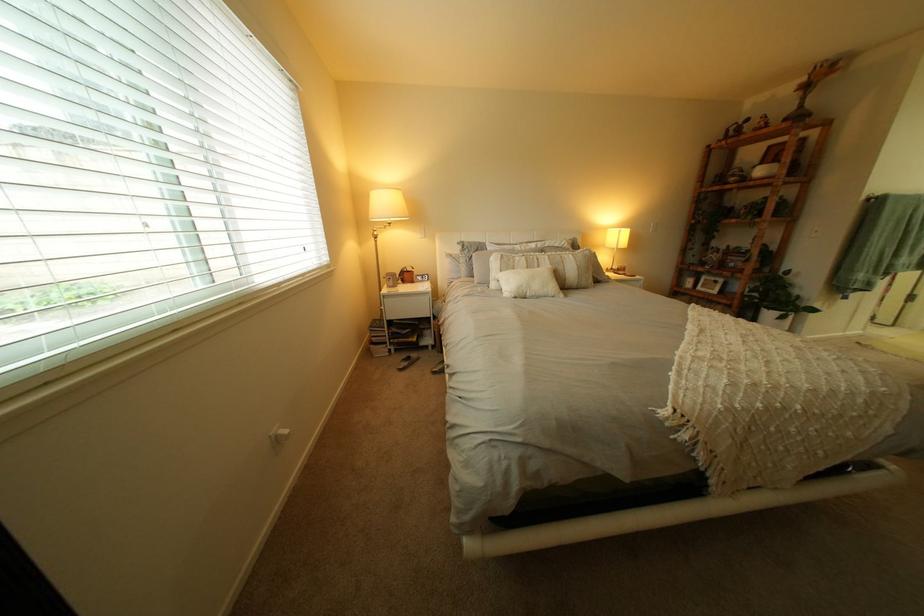
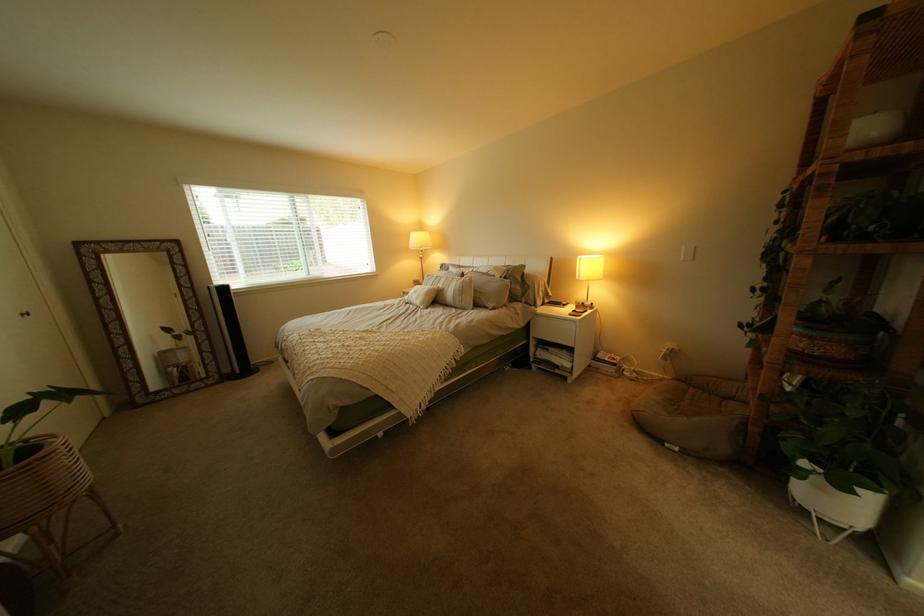
Find the pixel in the second image that matches (x=602, y=253) in the first image.

(482, 280)